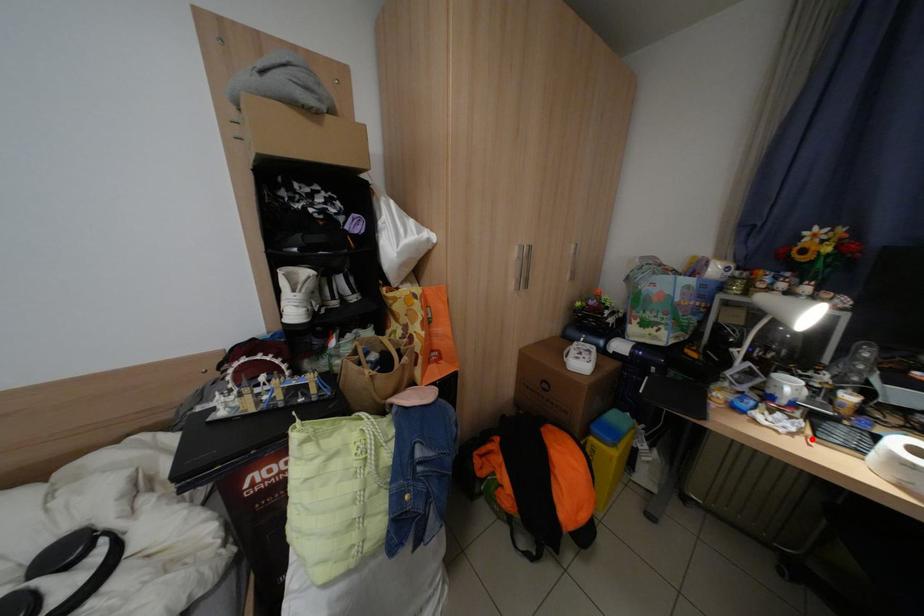
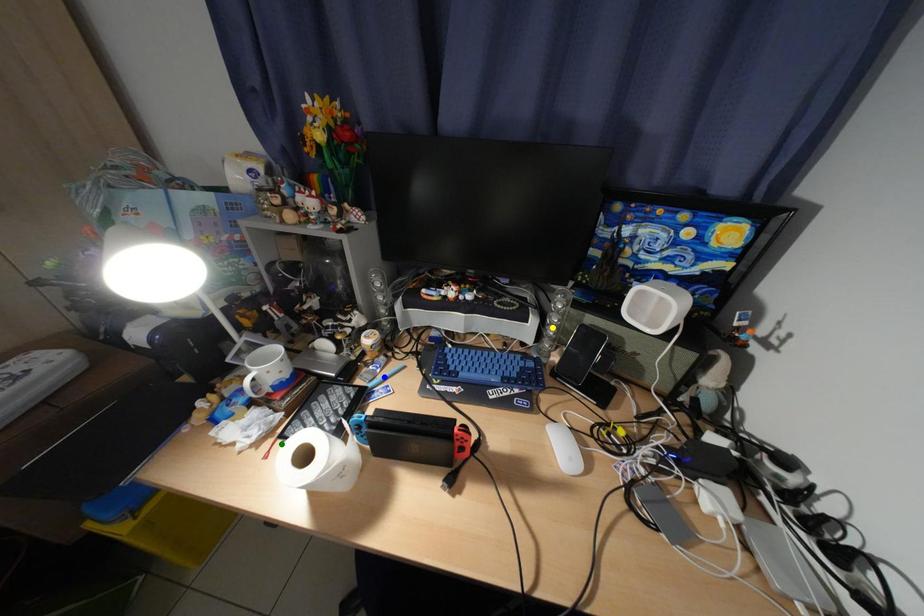
Question: I am providing you with two images of the same scene from different viewpoints. A red point is marked on the first image. You are given multiple points on the second image. Can you choose the point in image 2 that corresponds to the point in image 1?

Choices:
 (A) green point
 (B) blue point
 (C) yellow point

Answer: (A)